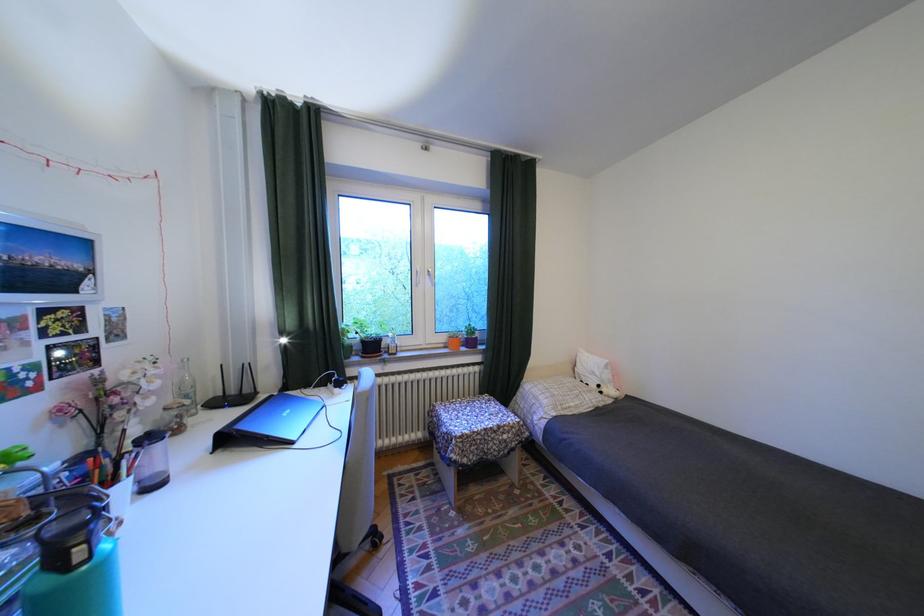
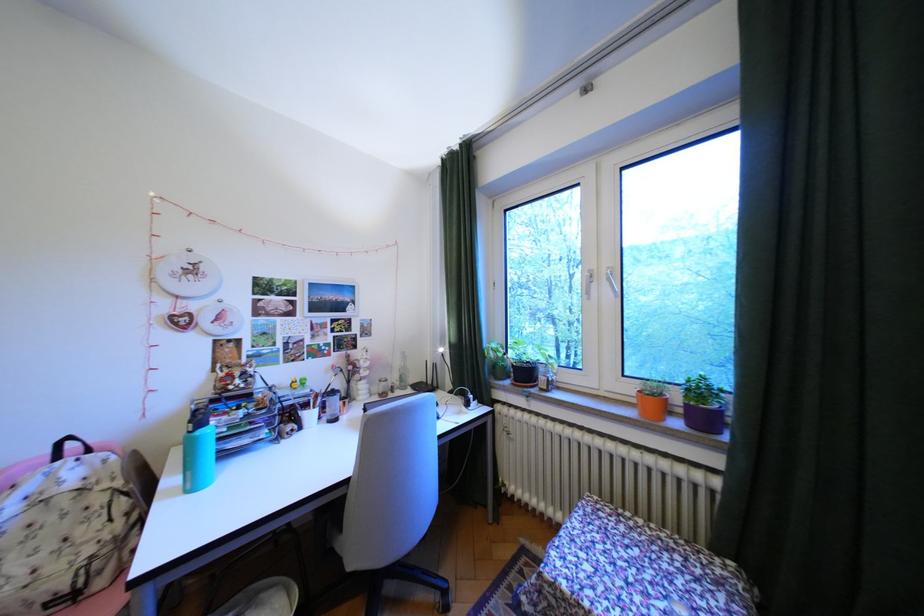
The point at (482, 331) is marked in the first image. Where is the corresponding point in the second image?

(710, 391)